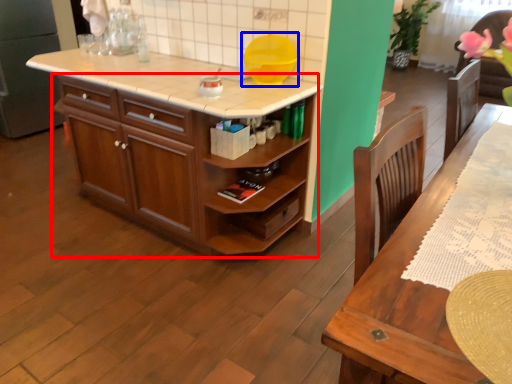
Question: Which point is further to the camera, cabinetry (highlighted by a red box) or appliance (highlighted by a blue box)?

Choices:
 (A) cabinetry
 (B) appliance

Answer: (B)